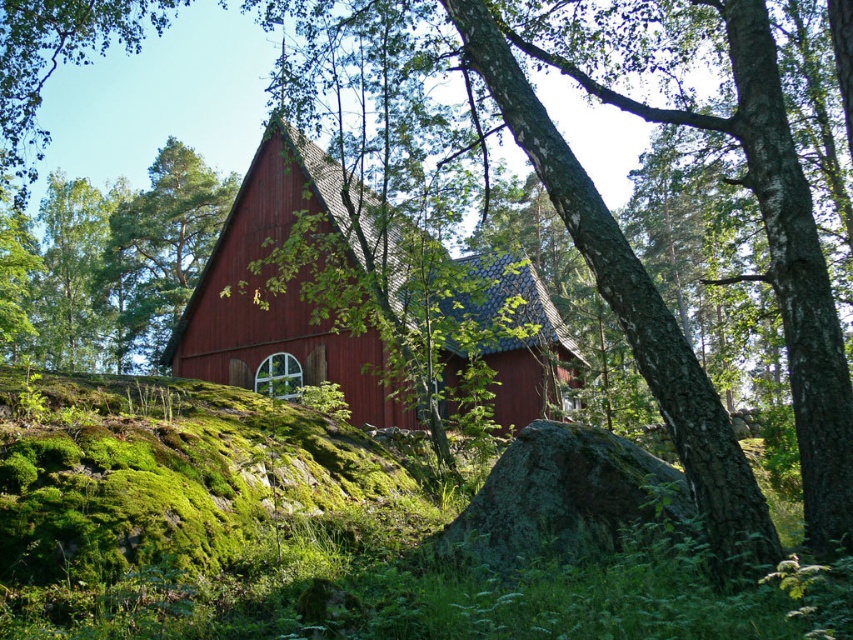
Between point (465, 301) and point (128, 202), which one is positioned in front?

Point (465, 301) is more forward.

Can you confirm if matte wooden barn at center is wider than smooth bark tree at center?

Correct, the width of matte wooden barn at center exceeds that of smooth bark tree at center.

Is point (281, 284) farther from camera compared to point (198, 193)?

No, (281, 284) is closer to viewer.

Locate an element on the screen. This screenshot has height=640, width=853. matte wooden barn at center is located at coordinates (364, 305).